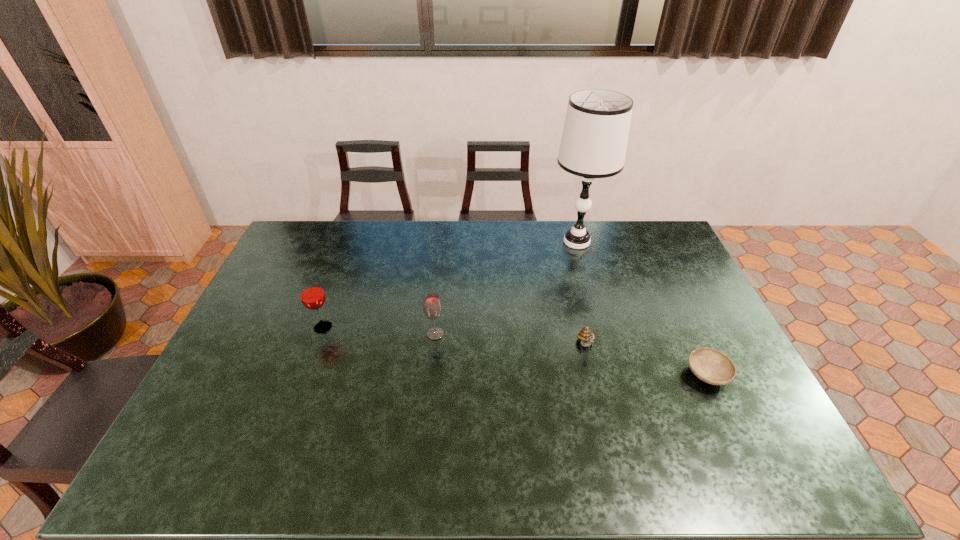
Where is `the tallest object`? Image resolution: width=960 pixels, height=540 pixels. the tallest object is located at coordinates (594, 141).

Where is `the farthest object`? the farthest object is located at coordinates (594, 141).

I want to click on the left glass drink container, so click(312, 295).

Where is `the third tallest object`? This screenshot has width=960, height=540. the third tallest object is located at coordinates tap(432, 307).

Where is `the second object from left to right`? the second object from left to right is located at coordinates (432, 307).

Where is `the second shortest object`? This screenshot has width=960, height=540. the second shortest object is located at coordinates (585, 335).

Find the location of `bowl`. bowl is located at coordinates pyautogui.click(x=711, y=366).

Locate an element on the screen. the rightmost object is located at coordinates (711, 366).

Locate an element on the screen. vacant space situated 0.360m on the left of the table lamp is located at coordinates (453, 242).

Where is `vacant space situated on the back of the left glass drink container`? This screenshot has width=960, height=540. vacant space situated on the back of the left glass drink container is located at coordinates (344, 269).